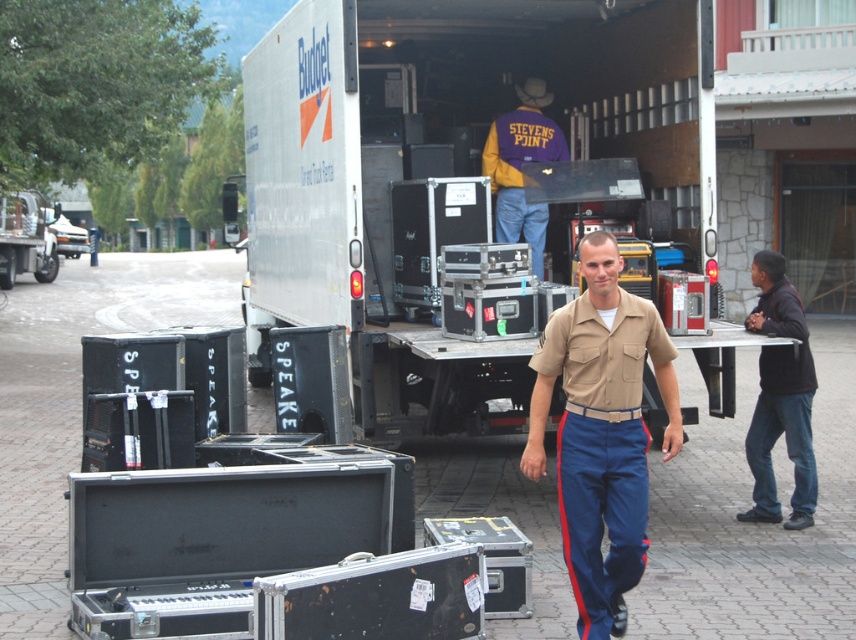
Does point (498, 118) come behind point (1, 257)?

No, it is not.

Between purple/yellow jacket at center and brushed metal speaker at left, which one is positioned lower?

purple/yellow jacket at center is lower down.

Does point (538, 268) come behind point (9, 220)?

That is False.

This screenshot has height=640, width=856. In order to click on purple/yellow jacket at center in this screenshot , I will do `click(520, 164)`.

Between black matte jacket at right and purple/yellow jacket at center, which one is positioned higher?

Positioned higher is purple/yellow jacket at center.

Which is behind, point (759, 435) or point (513, 220)?

The point (513, 220) is more distant.

Between point (779, 305) and point (520, 164), which one is positioned behind?

The point (520, 164) is behind.

At what (x,y) coordinates should I click in order to perform the action: click on black matte jacket at right. Please return your answer as a coordinate pair (x, y). This screenshot has width=856, height=640. Looking at the image, I should click on (780, 397).

Which is more to the right, white matte trailer truck at center or purple/yellow jacket at center?

purple/yellow jacket at center

Is point (254, 291) in front of point (509, 234)?

No, it is not.

Find the location of a particular element. Image resolution: width=856 pixels, height=640 pixels. white matte trailer truck at center is located at coordinates (450, 177).